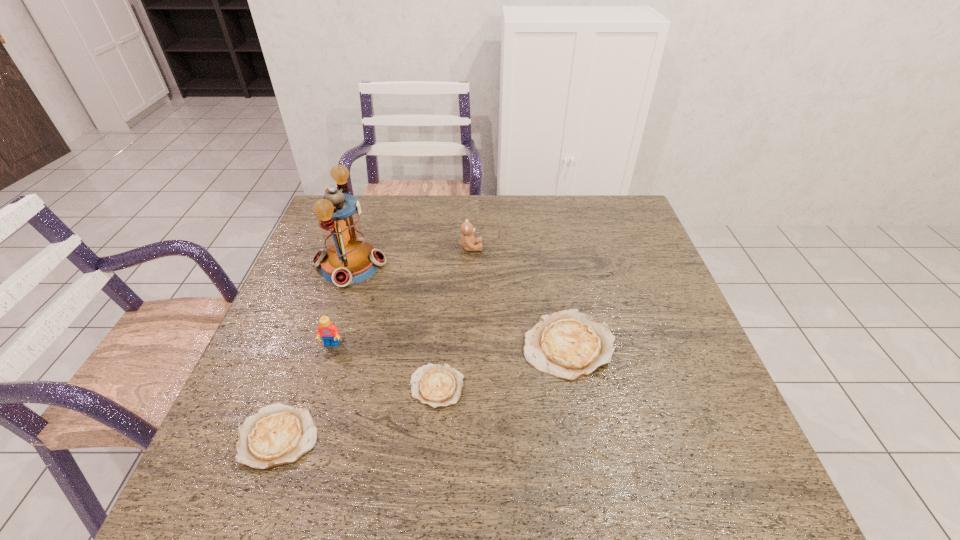
This screenshot has width=960, height=540. Find the location of `vacant space at the near edge`. vacant space at the near edge is located at coordinates (652, 432).

The width and height of the screenshot is (960, 540). Identify the location of free space at the left edge. (244, 397).

Locate an element on the screen. Image resolution: width=960 pixels, height=540 pixels. vacant area at the right edge of the desktop is located at coordinates (655, 271).

Identify the location of vacant space at the far right corner. This screenshot has width=960, height=540. (617, 216).

Image resolution: width=960 pixels, height=540 pixels. Find the location of `vacant space at the near right corner of the desktop`. vacant space at the near right corner of the desktop is located at coordinates (671, 423).

Where is `empty location between the tallest object and the Lego`? This screenshot has height=540, width=960. empty location between the tallest object and the Lego is located at coordinates (341, 305).

At what (x,y) coordinates should I click in order to perform the action: click on free space between the teddy bear and the Lego. Please return your answer as a coordinate pair (x, y). Looking at the image, I should click on (401, 296).

Find the location of a particular element. The height and width of the screenshot is (540, 960). empty space that is in between the teddy bear and the lantern is located at coordinates (411, 256).

Where is `vacant area that lies between the tallest quiche and the tallest object`? The height and width of the screenshot is (540, 960). vacant area that lies between the tallest quiche and the tallest object is located at coordinates (460, 305).

The height and width of the screenshot is (540, 960). Find the location of `unoccupied position between the leftmost quiche and the shortest quiche`. unoccupied position between the leftmost quiche and the shortest quiche is located at coordinates (358, 412).